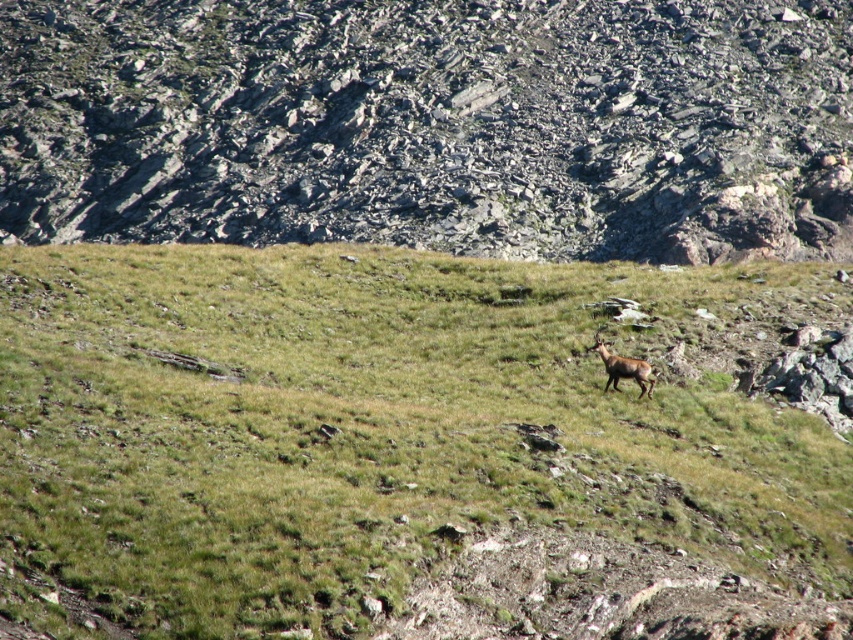
Looking at this image, you are a hiker navigating a steep mountain slope. You notice a gray rock at upper center located at point (433, 124). If you want to avoid this rock, which direction should you move relative to your current position?

To avoid the gray rock at upper center located at point (433, 124), you should move either to the left or right of the rock depending on your current position relative to it. Since the rock is at upper center, moving downward or sideways away from its coordinates would help you bypass it safely.